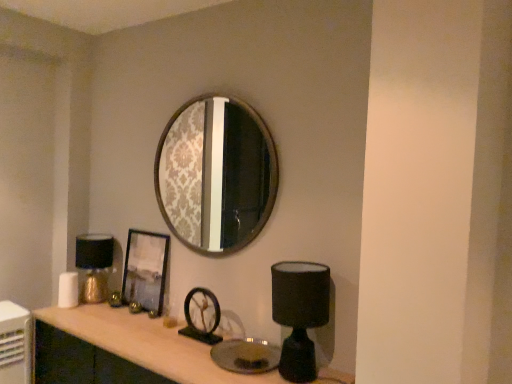
Question: Is gold metallic table lamp at left, the first table lamp from the left, beside black matte table lamp at lower right, placed as the 1th table lamp when sorted from front to back?

Choices:
 (A) yes
 (B) no

Answer: (B)

Question: Is gold metallic table lamp at left, placed as the 2th table lamp when sorted from right to left, to the left of black matte table lamp at lower right, which ranks as the second table lamp in back-to-front order, from the viewer's perspective?

Choices:
 (A) no
 (B) yes

Answer: (B)

Question: Is the position of gold metallic table lamp at left, positioned as the first table lamp in back-to-front order, less distant than that of black matte table lamp at lower right, which ranks as the second table lamp in back-to-front order?

Choices:
 (A) no
 (B) yes

Answer: (A)

Question: Does gold metallic table lamp at left, positioned as the first table lamp in back-to-front order, have a greater width compared to black matte table lamp at lower right, which ranks as the second table lamp in back-to-front order?

Choices:
 (A) yes
 (B) no

Answer: (B)

Question: Could you tell me if gold metallic table lamp at left, positioned as the first table lamp in back-to-front order, is turned towards black matte table lamp at lower right, placed as the 1th table lamp when sorted from front to back?

Choices:
 (A) yes
 (B) no

Answer: (B)

Question: Can you confirm if gold metallic table lamp at left, positioned as the first table lamp in back-to-front order, is taller than black matte table lamp at lower right, acting as the first table lamp starting from the right?

Choices:
 (A) no
 (B) yes

Answer: (A)

Question: From the image's perspective, would you say black matte table lamp at lower right, the 2th table lamp in the left-to-right sequence, is positioned over matte wood computer desk at center?

Choices:
 (A) no
 (B) yes

Answer: (B)

Question: Is black matte table lamp at lower right, acting as the first table lamp starting from the right, next to matte wood computer desk at center and touching it?

Choices:
 (A) no
 (B) yes

Answer: (A)

Question: Considering the relative sizes of black matte table lamp at lower right, the 2th table lamp in the left-to-right sequence, and matte wood computer desk at center in the image provided, is black matte table lamp at lower right, the 2th table lamp in the left-to-right sequence, wider than matte wood computer desk at center?

Choices:
 (A) yes
 (B) no

Answer: (B)

Question: Is black matte table lamp at lower right, acting as the first table lamp starting from the right, shorter than matte wood computer desk at center?

Choices:
 (A) yes
 (B) no

Answer: (A)

Question: Is black matte table lamp at lower right, the 2th table lamp in the left-to-right sequence, to the right of matte wood computer desk at center from the viewer's perspective?

Choices:
 (A) no
 (B) yes

Answer: (B)

Question: From a real-world perspective, is black matte table lamp at lower right, which ranks as the second table lamp in back-to-front order, physically below matte wood computer desk at center?

Choices:
 (A) no
 (B) yes

Answer: (A)

Question: Is matte wood computer desk at center next to metallic silver picture frame at center and touching it?

Choices:
 (A) no
 (B) yes

Answer: (A)